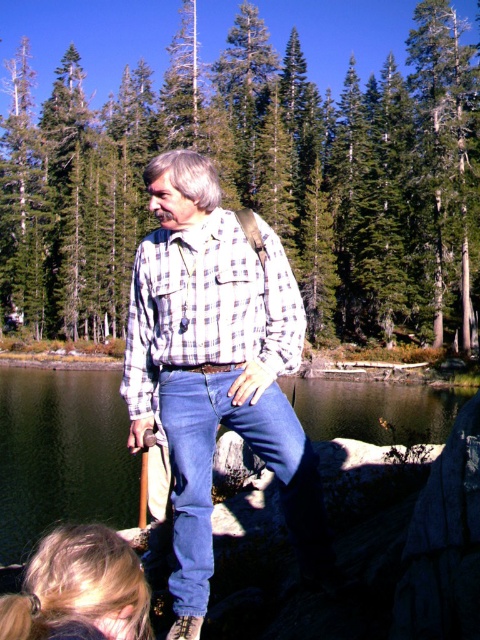
Question: Which of these objects is positioned farthest from the white checkered shirt at center?

Choices:
 (A) checkered fabric shirt at center
 (B) clear water at lower center

Answer: (B)

Question: Does white checkered shirt at center have a greater width compared to checkered fabric shirt at center?

Choices:
 (A) yes
 (B) no

Answer: (B)

Question: Is white checkered shirt at center further to the viewer compared to clear water at lower center?

Choices:
 (A) yes
 (B) no

Answer: (B)

Question: Which point is farther to the camera?

Choices:
 (A) (0, 522)
 (B) (144, 346)

Answer: (A)

Question: Observing the image, what is the correct spatial positioning of white checkered shirt at center in reference to clear water at lower center?

Choices:
 (A) right
 (B) left

Answer: (A)

Question: Which object appears farthest from the camera in this image?

Choices:
 (A) clear water at lower center
 (B) white checkered shirt at center

Answer: (A)